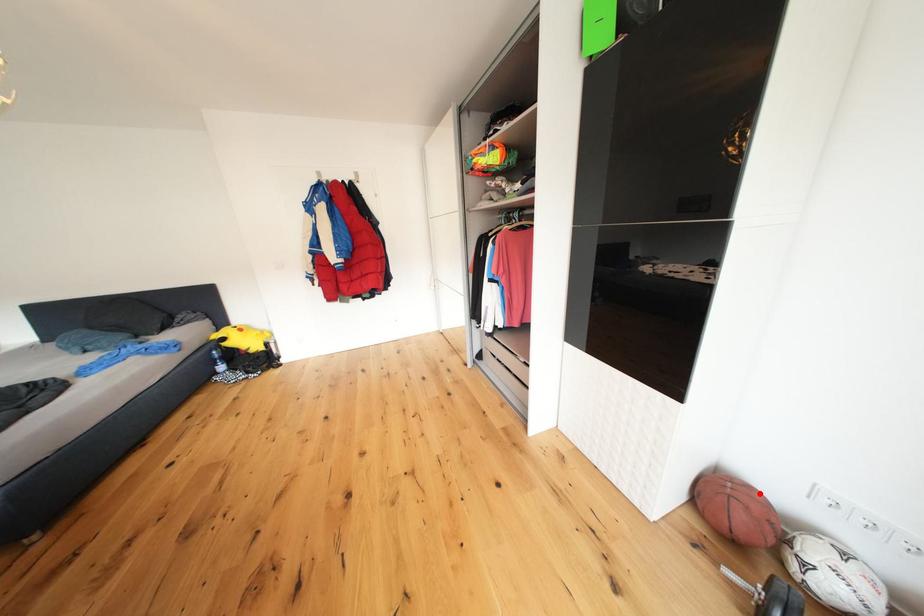
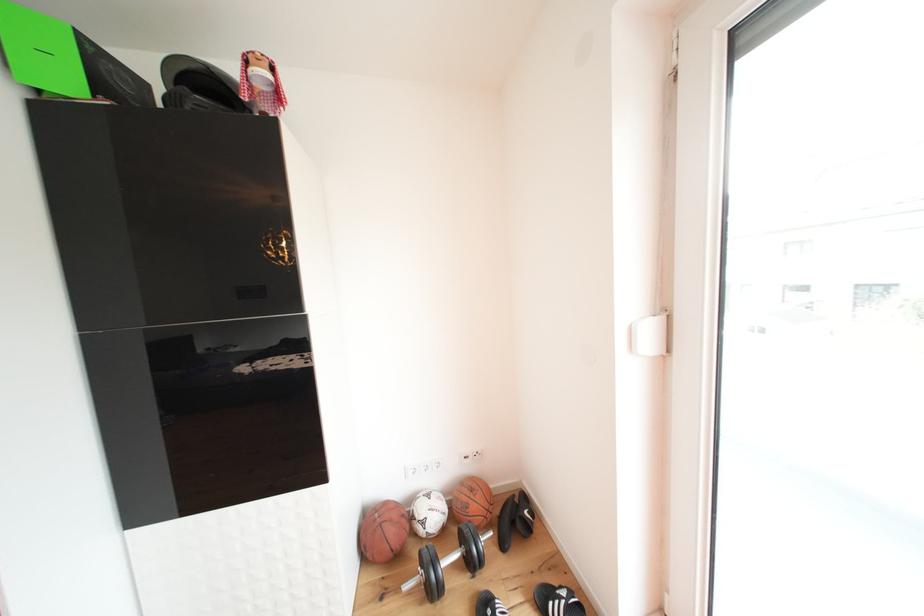
Where in the second image is the point corresponding to the highlighted location from the first image?

(395, 509)